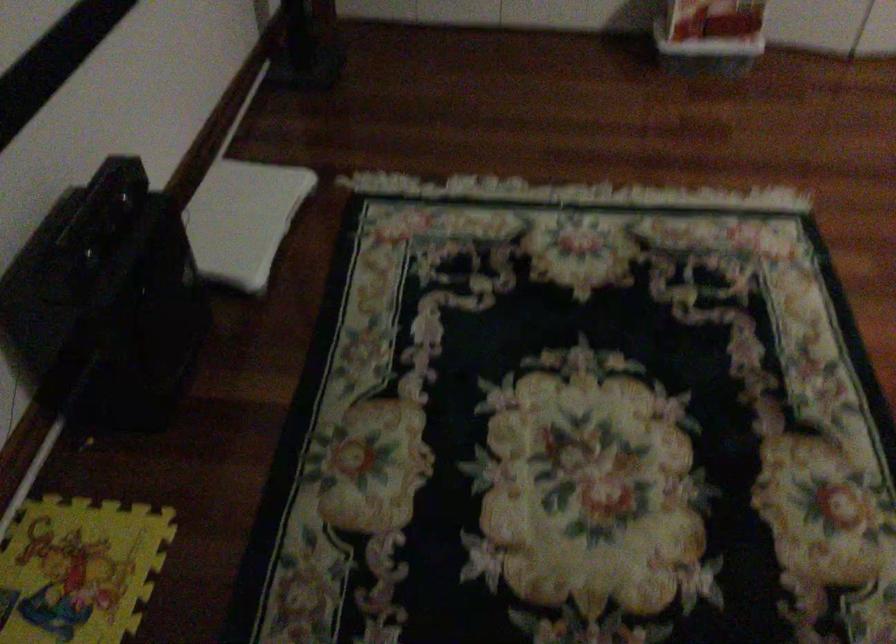
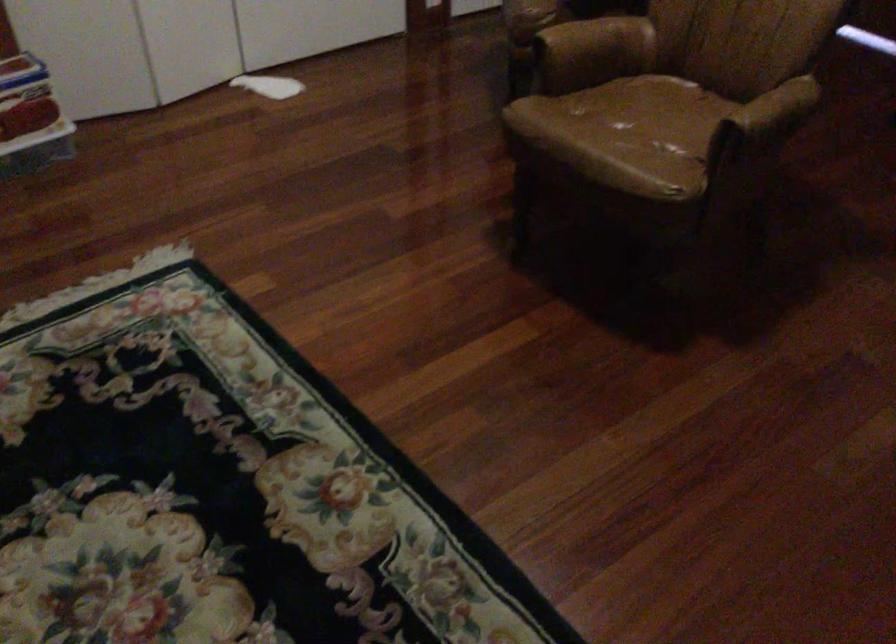
Question: The camera is either moving clockwise (left) or counter-clockwise (right) around the object. The first image is from the beginning of the video and the second image is from the end. Is the camera moving left or right when shooting the video?

Choices:
 (A) Left
 (B) Right

Answer: (A)